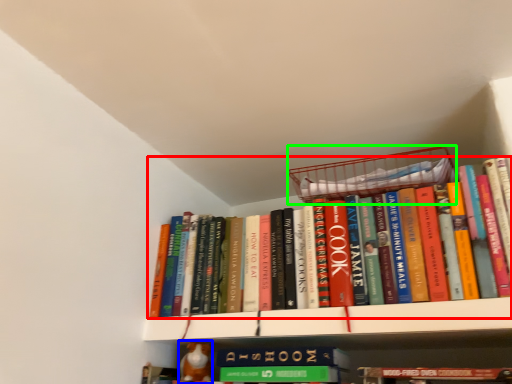
Question: Based on their relative distances, which object is nearer to book (highlighted by a red box)? Choose from toy (highlighted by a blue box) and basket (highlighted by a green box).

Choices:
 (A) toy
 (B) basket

Answer: (B)